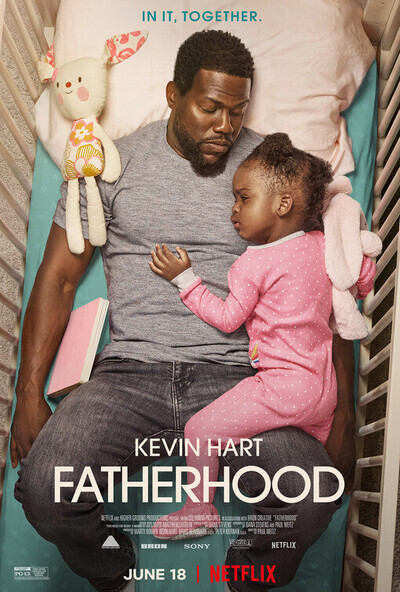
Where is `pink book`? pink book is located at coordinates (77, 340).